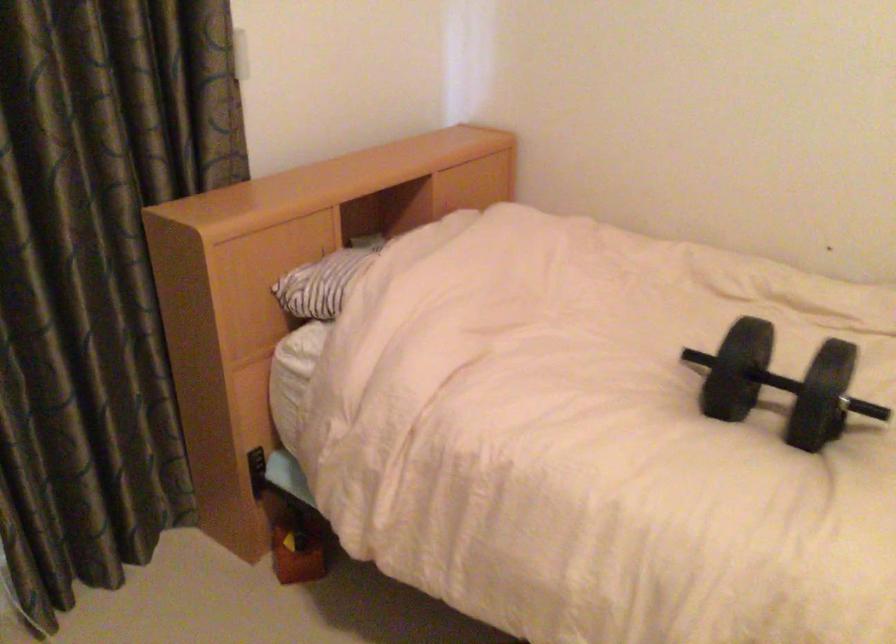
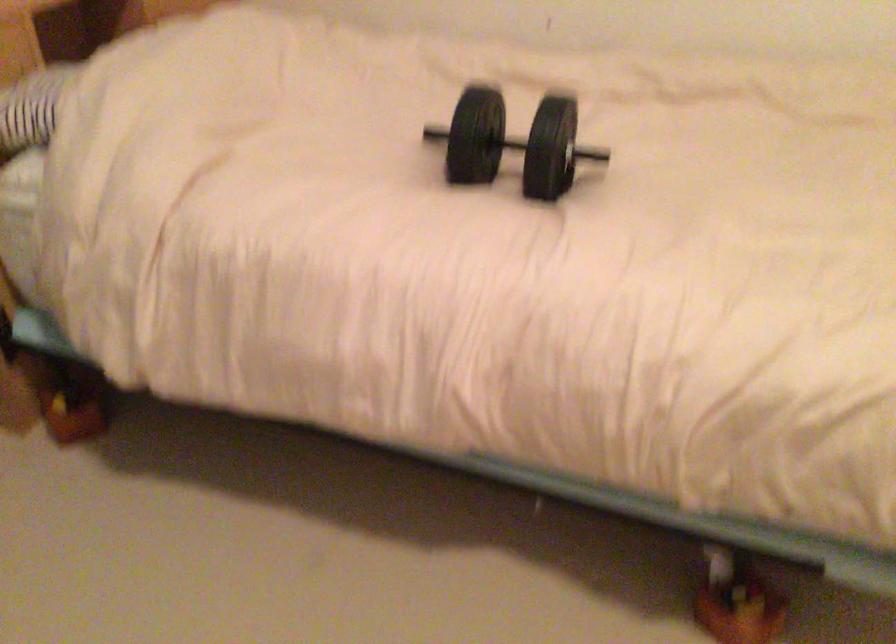
The point at (777,371) is marked in the first image. Where is the corresponding point in the second image?

(513, 143)